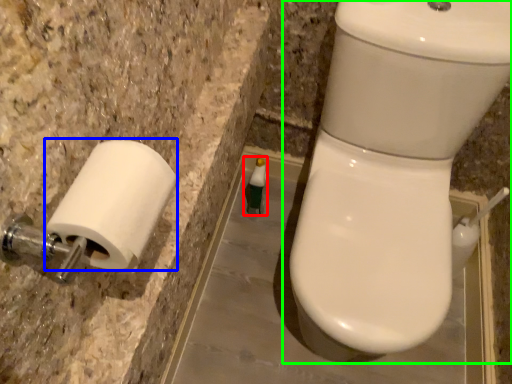
Question: Considering the real-world distances, which object is farthest from toiletry (highlighted by a red box)? toilet paper (highlighted by a blue box) or toilet (highlighted by a green box)?

Choices:
 (A) toilet paper
 (B) toilet

Answer: (A)